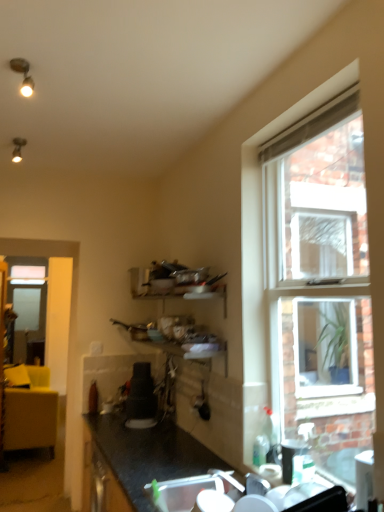
Question: Is clear glass window at right facing towards transparent glass screen door at left?

Choices:
 (A) no
 (B) yes

Answer: (A)

Question: From a real-world perspective, is clear glass window at right on transparent glass screen door at left?

Choices:
 (A) yes
 (B) no

Answer: (A)

Question: Is clear glass window at right completely or partially outside of transparent glass screen door at left?

Choices:
 (A) yes
 (B) no

Answer: (A)

Question: Can you confirm if clear glass window at right is taller than transparent glass screen door at left?

Choices:
 (A) no
 (B) yes

Answer: (A)

Question: Considering the relative sizes of clear glass window at right and transparent glass screen door at left in the image provided, is clear glass window at right bigger than transparent glass screen door at left?

Choices:
 (A) yes
 (B) no

Answer: (A)

Question: Considering the relative positions of clear glass window at right and transparent glass screen door at left in the image provided, is clear glass window at right to the left of transparent glass screen door at left from the viewer's perspective?

Choices:
 (A) no
 (B) yes

Answer: (A)

Question: Does black plastic cup at lower right, arranged as the 2th appliance when viewed from the back, lie behind white plastic sink at lower center?

Choices:
 (A) no
 (B) yes

Answer: (B)

Question: Is black plastic cup at lower right, the first appliance in the right-to-left sequence, thinner than white plastic sink at lower center?

Choices:
 (A) no
 (B) yes

Answer: (B)

Question: Is black plastic cup at lower right, which is the second appliance from left to right, next to white plastic sink at lower center?

Choices:
 (A) yes
 (B) no

Answer: (B)

Question: Is black plastic cup at lower right, the first appliance in the right-to-left sequence, not near white plastic sink at lower center?

Choices:
 (A) yes
 (B) no

Answer: (B)

Question: Could you tell me if black plastic cup at lower right, the first appliance in the right-to-left sequence, is facing white plastic sink at lower center?

Choices:
 (A) no
 (B) yes

Answer: (B)

Question: Can you confirm if black plastic cup at lower right, which is the second appliance from left to right, is smaller than white plastic sink at lower center?

Choices:
 (A) yes
 (B) no

Answer: (A)

Question: From the image's perspective, does transparent glass screen door at left appear lower than black plastic cup at lower right, arranged as the 2th appliance when viewed from the back?

Choices:
 (A) no
 (B) yes

Answer: (B)